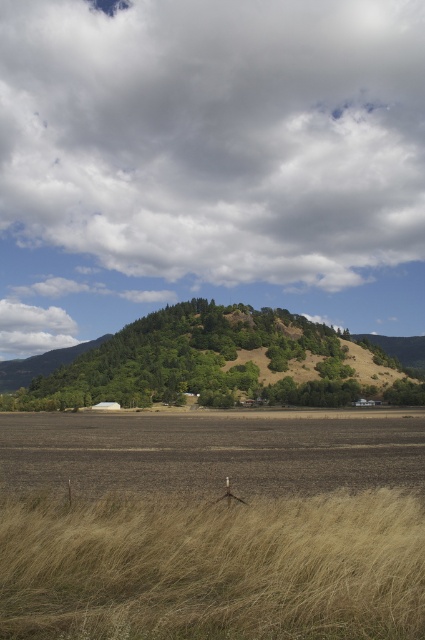
Question: Which point appears farthest from the camera in this image?

Choices:
 (A) (317, 177)
 (B) (39, 474)

Answer: (A)

Question: Which point is closer to the camera?

Choices:
 (A) tap(337, 19)
 (B) tap(243, 422)

Answer: (B)

Question: Does cloudy sky at upper center have a smaller size compared to brown soil at center?

Choices:
 (A) no
 (B) yes

Answer: (A)

Question: Can you confirm if cloudy sky at upper center is smaller than brown soil at center?

Choices:
 (A) yes
 (B) no

Answer: (B)

Question: Considering the real-world distances, which object is closest to the brown soil at center?

Choices:
 (A) cloudy sky at upper center
 (B) dry grass at lower left

Answer: (B)

Question: Where is cloudy sky at upper center located in relation to dry grass at lower left in the image?

Choices:
 (A) left
 (B) right

Answer: (A)